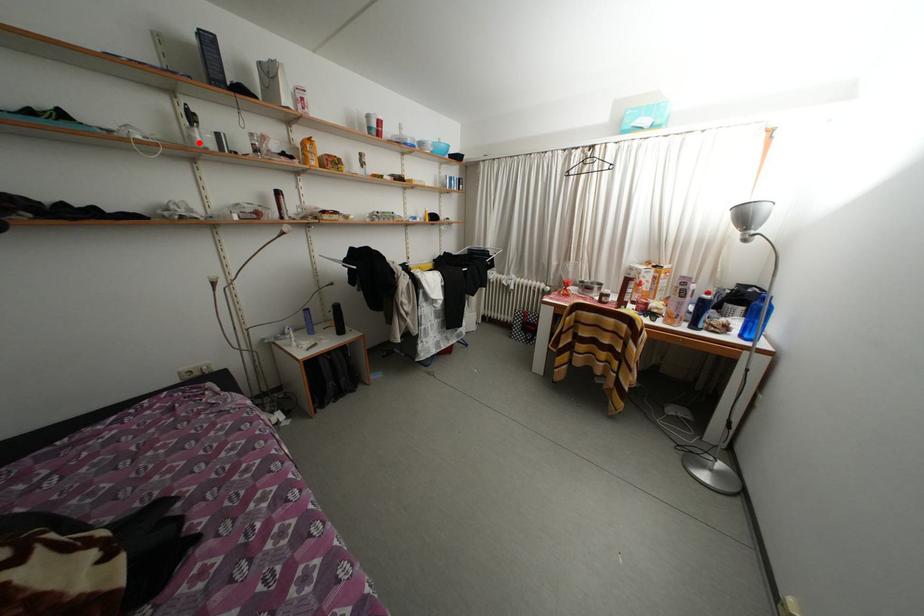
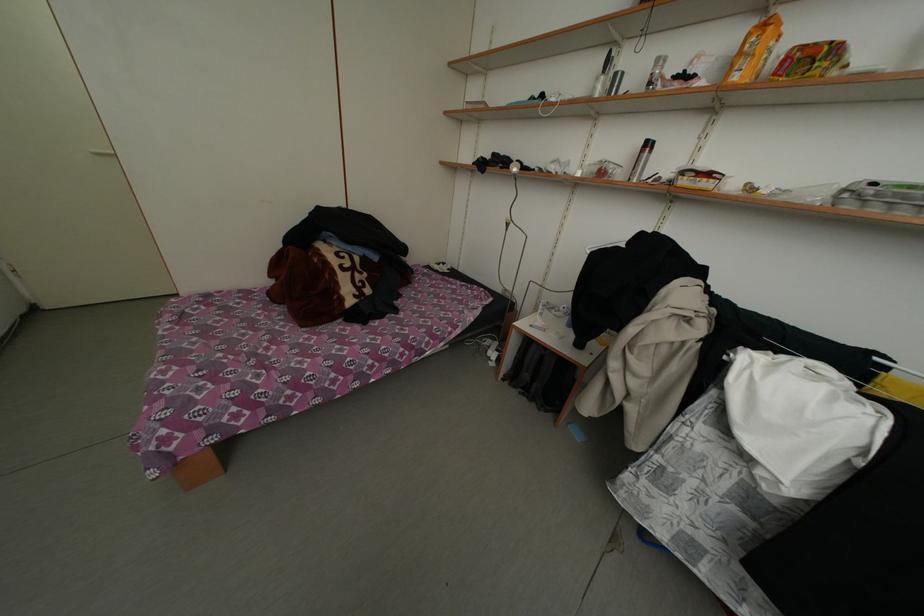
Locate, in the second image, the point that corresponds to the highlighted location in the first image.

(602, 94)